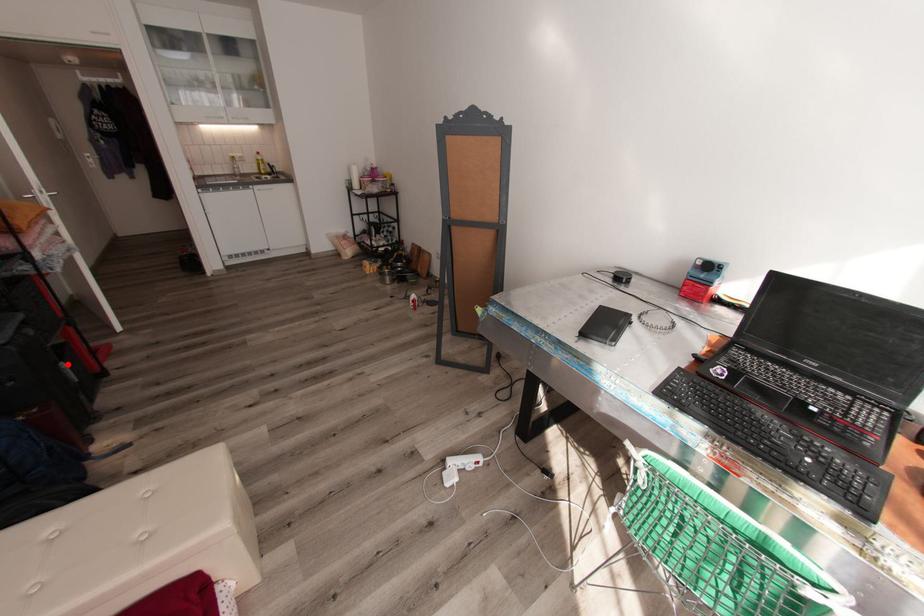
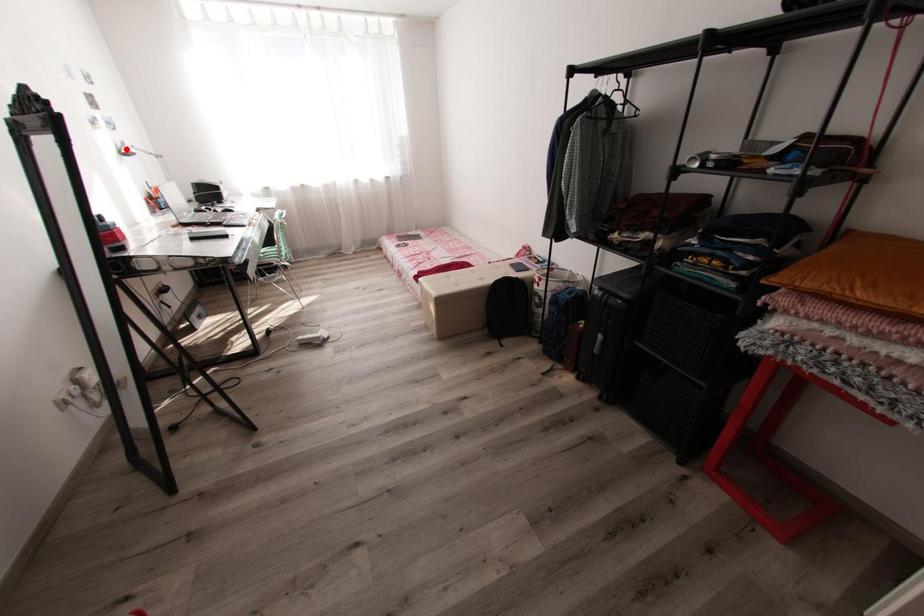
I am providing you with two images of the same scene from different viewpoints. A red point is marked on the first image and another point is marked on the second image. Does the point marked in image1 correspond to the same location as the one in image2?

No